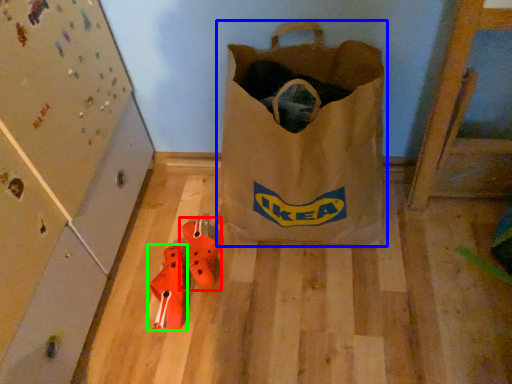
Question: Which object is positioned farthest from footwear (highlighted by a red box)? Select from luggage and bags (highlighted by a blue box) and footwear (highlighted by a green box).

Choices:
 (A) luggage and bags
 (B) footwear

Answer: (A)